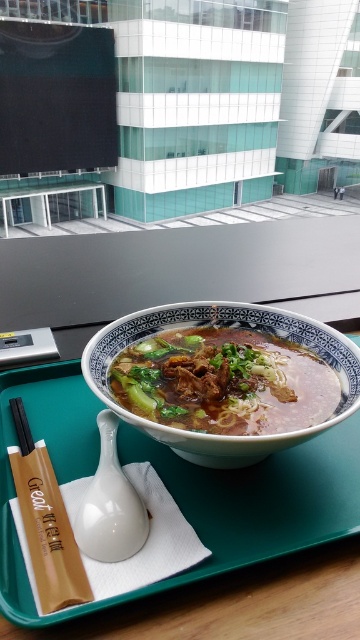
Does brown matte noodles at center come in front of black wood chopsticks at upper left?

Yes, it is in front of black wood chopsticks at upper left.

Is brown matte noodles at center to the right of black wood chopsticks at upper left from the viewer's perspective?

Indeed, brown matte noodles at center is positioned on the right side of black wood chopsticks at upper left.

Describe the element at coordinates (223, 381) in the screenshot. The width and height of the screenshot is (360, 640). I see `brown matte noodles at center` at that location.

You are a GUI agent. You are given a task and a screenshot of the screen. Output one action in this format:
    pyautogui.click(x=<x>, y=<y>)
    Task: Click on the brown matte noodles at center
    The width and height of the screenshot is (360, 640).
    Given the screenshot: What is the action you would take?
    pyautogui.click(x=223, y=381)

Can you confirm if green plastic tray at center is positioned to the right of black wood chopsticks at upper left?

Correct, you'll find green plastic tray at center to the right of black wood chopsticks at upper left.

Which is in front, point (306, 461) or point (20, 426)?

Point (306, 461) is in front.

I want to click on green plastic tray at center, so click(x=178, y=490).

What do you see at coordinates (178, 490) in the screenshot?
I see `green plastic tray at center` at bounding box center [178, 490].

Which is in front, point (258, 509) or point (273, 417)?

Point (258, 509) is in front.

Image resolution: width=360 pixels, height=640 pixels. Describe the element at coordinates (178, 490) in the screenshot. I see `green plastic tray at center` at that location.

This screenshot has height=640, width=360. In order to click on green plastic tray at center in this screenshot , I will do `click(178, 490)`.